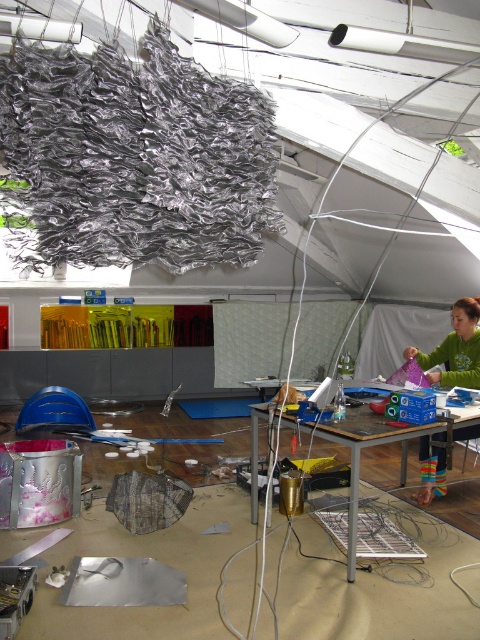
Is green fabric at lower right shorter than metallic silver table at center?

Correct, green fabric at lower right is not as tall as metallic silver table at center.

Who is taller, green fabric at lower right or metallic silver table at center?

metallic silver table at center is taller.

Is point (456, 308) farther from camera compared to point (351, 429)?

Yes, it is.

I want to click on green fabric at lower right, so click(455, 349).